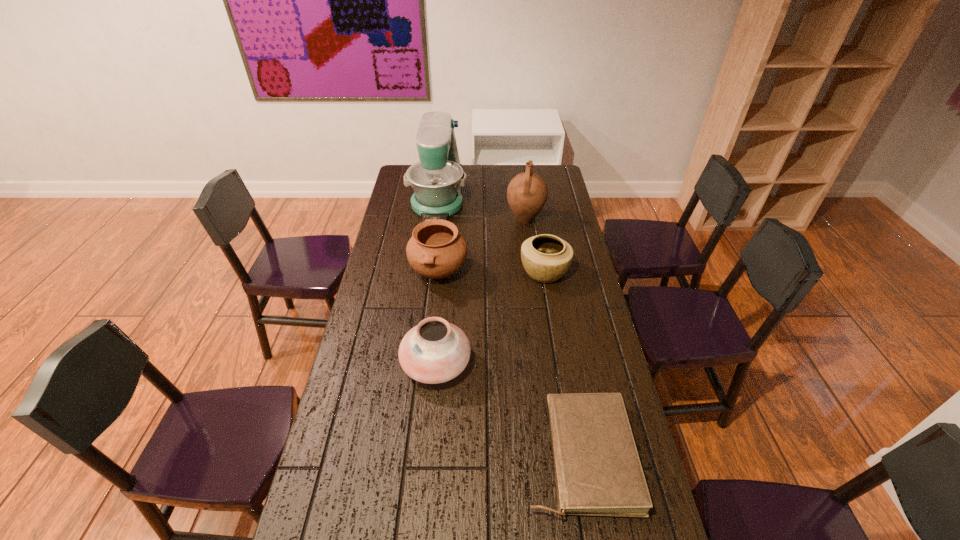
The width and height of the screenshot is (960, 540). I want to click on mixer, so click(437, 179).

Where is `the fifth shortest object`? The width and height of the screenshot is (960, 540). the fifth shortest object is located at coordinates (527, 192).

Find the location of a particular element. The height and width of the screenshot is (540, 960). the nearest pottery is located at coordinates (435, 351).

Find the location of `the fifth tallest object`. the fifth tallest object is located at coordinates (546, 258).

The image size is (960, 540). What are the coordinates of `the shortest pottery` in the screenshot? It's located at point(546,258).

What are the coordinates of `the nearest object` in the screenshot? It's located at (598, 472).

The height and width of the screenshot is (540, 960). In order to click on the shortest object in this screenshot , I will do `click(598, 472)`.

The image size is (960, 540). Find the location of `free region located 0.300m on the front-facing side of the tallest object`. free region located 0.300m on the front-facing side of the tallest object is located at coordinates (429, 268).

Image resolution: width=960 pixels, height=540 pixels. Identify the location of vacant region located on the left of the fifth shortest object. (468, 220).

You are a GUI agent. You are given a task and a screenshot of the screen. Output one action in this format:
    pyautogui.click(x=<x>, y=<y>)
    Task: Click on the free space located 0.050m on the right of the second nearest object
    Image resolution: width=960 pixels, height=540 pixels.
    Given the screenshot: What is the action you would take?
    pyautogui.click(x=487, y=364)